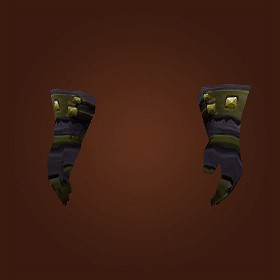
Locate an element on the screen. Image resolution: width=280 pixels, height=280 pixels. inlaid ornamentation is located at coordinates (231, 100), (213, 107), (204, 96), (70, 110), (75, 99), (55, 105).